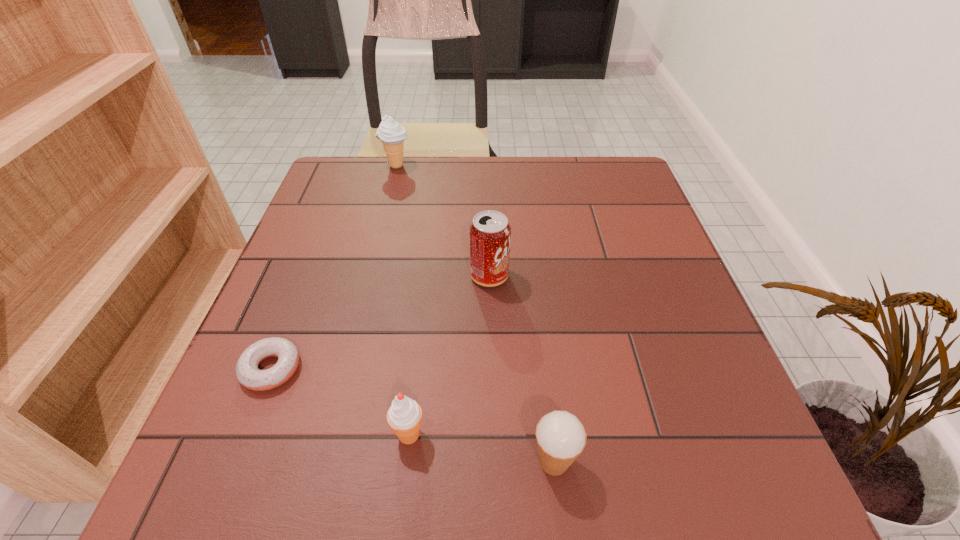
Find the location of a particular element. blank space located 0.120m on the right of the third object from right to left is located at coordinates (501, 434).

The image size is (960, 540). What are the coordinates of `vacant space located on the left of the rightmost object` in the screenshot? It's located at (465, 462).

The image size is (960, 540). In order to click on blank area located on the right of the doughnut in this screenshot , I will do `click(469, 369)`.

Image resolution: width=960 pixels, height=540 pixels. Find the location of `object that is at the far edge`. object that is at the far edge is located at coordinates (392, 135).

Find the location of a particular element. This screenshot has width=960, height=540. icecream at the left edge is located at coordinates [x=392, y=135].

Where is `doughnut that is at the left edge`? This screenshot has width=960, height=540. doughnut that is at the left edge is located at coordinates (248, 374).

This screenshot has width=960, height=540. In order to click on object that is positioned at the far left corner in this screenshot , I will do `click(392, 135)`.

Image resolution: width=960 pixels, height=540 pixels. I want to click on free space at the far edge, so click(416, 197).

Locate an element on the screen. This screenshot has height=540, width=960. free region at the left edge of the desktop is located at coordinates point(352,212).

The image size is (960, 540). In the image, there is a desktop. What are the coordinates of `vacant space at the right edge` in the screenshot? It's located at (648, 310).